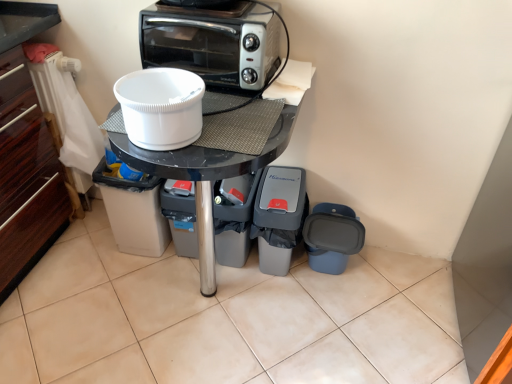
At what (x,y) coordinates should I click in order to perform the action: click on vacant region to the right of blue plastic trash can at lower right, the fifth appliance when ordered from left to right. Please return your answer as a coordinate pair (x, y). This screenshot has width=512, height=384. Looking at the image, I should click on (382, 278).